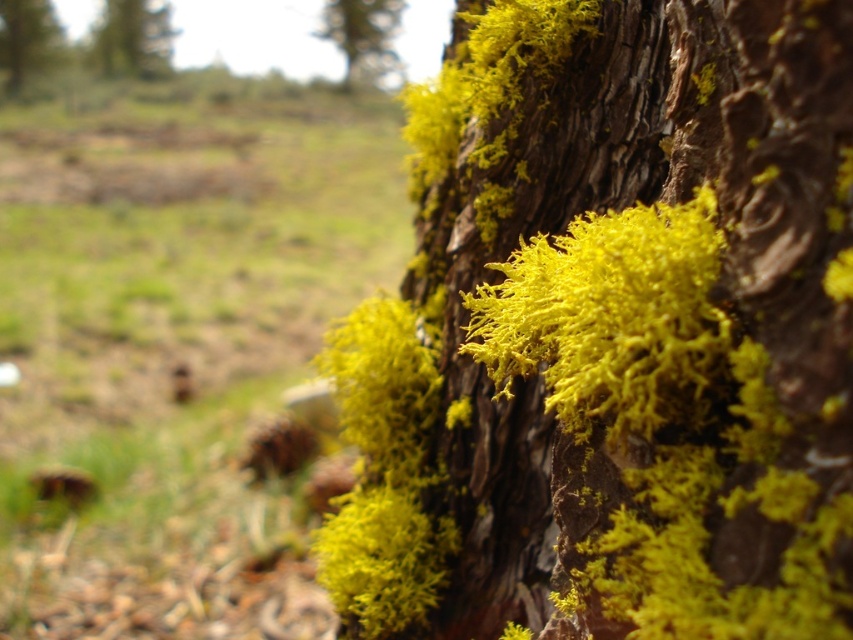
You are an artist sketching the tree trunk and notice two areas of yellow mossy bark. Which one is positioned to the right when comparing the yellow mossy bark at upper center and the yellow mossy bark at upper left?

The yellow mossy bark at upper center is positioned to the right of the yellow mossy bark at upper left.

You are an artist sketching the tree trunk and want to highlight the size differences between the yellow mossy bark at upper center and the yellow mossy bark at upper left. Which one should you draw larger in your sketch?

You should draw the yellow mossy bark at upper left larger than the yellow mossy bark at upper center because the yellow mossy bark at upper center has a smaller size compared to yellow mossy bark at upper left.

You are an artist sketching the tree trunk. You notice two areas of yellow moss at the upper left. Which one is closer to you when looking at the yellow fuzzy moss at upper left and the yellow mossy bark at upper left?

The yellow fuzzy moss at upper left is closer to you since it is in front of the yellow mossy bark at upper left.